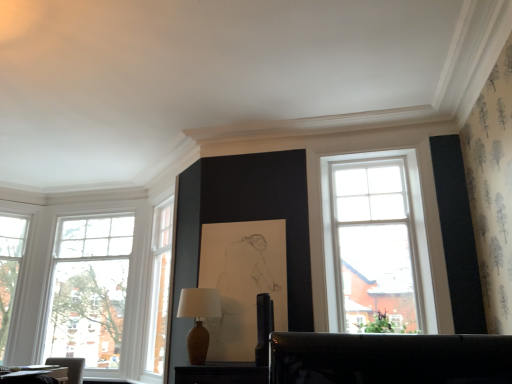
Question: Is matte brown vase at center aimed at clear glass window at left, placed as the second window when sorted from left to right?

Choices:
 (A) yes
 (B) no

Answer: (B)

Question: Does matte brown vase at center have a larger size compared to clear glass window at left, placed as the second window when sorted from left to right?

Choices:
 (A) no
 (B) yes

Answer: (A)

Question: Would you say matte brown vase at center is a long distance from clear glass window at left, placed as the second window when sorted from left to right?

Choices:
 (A) yes
 (B) no

Answer: (A)

Question: Is matte brown vase at center thinner than clear glass window at left, placed as the second window when sorted from left to right?

Choices:
 (A) yes
 (B) no

Answer: (B)

Question: Is the depth of matte brown vase at center greater than that of clear glass window at left, placed as the second window when sorted from left to right?

Choices:
 (A) yes
 (B) no

Answer: (B)

Question: Is matte brown vase at center looking in the opposite direction of clear glass window at left, placed as the second window when sorted from left to right?

Choices:
 (A) no
 (B) yes

Answer: (A)

Question: From the image's perspective, does matte brown vase at center appear lower than wooden table at lower left?

Choices:
 (A) no
 (B) yes

Answer: (A)

Question: Does matte brown vase at center have a larger size compared to wooden table at lower left?

Choices:
 (A) yes
 (B) no

Answer: (A)

Question: Considering the relative sizes of matte brown vase at center and wooden table at lower left in the image provided, is matte brown vase at center shorter than wooden table at lower left?

Choices:
 (A) no
 (B) yes

Answer: (A)

Question: Does matte brown vase at center touch wooden table at lower left?

Choices:
 (A) no
 (B) yes

Answer: (A)

Question: Does matte brown vase at center have a greater width compared to wooden table at lower left?

Choices:
 (A) yes
 (B) no

Answer: (B)

Question: From the image's perspective, is matte brown vase at center above wooden table at lower left?

Choices:
 (A) no
 (B) yes

Answer: (B)

Question: Can you confirm if wooden table at lower left is bigger than matte brown vase at center?

Choices:
 (A) no
 (B) yes

Answer: (A)